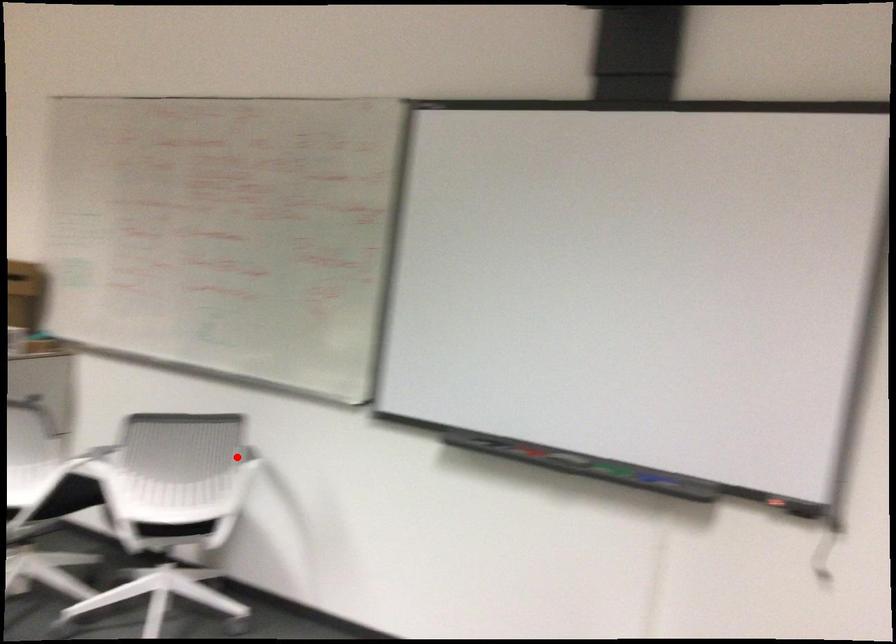
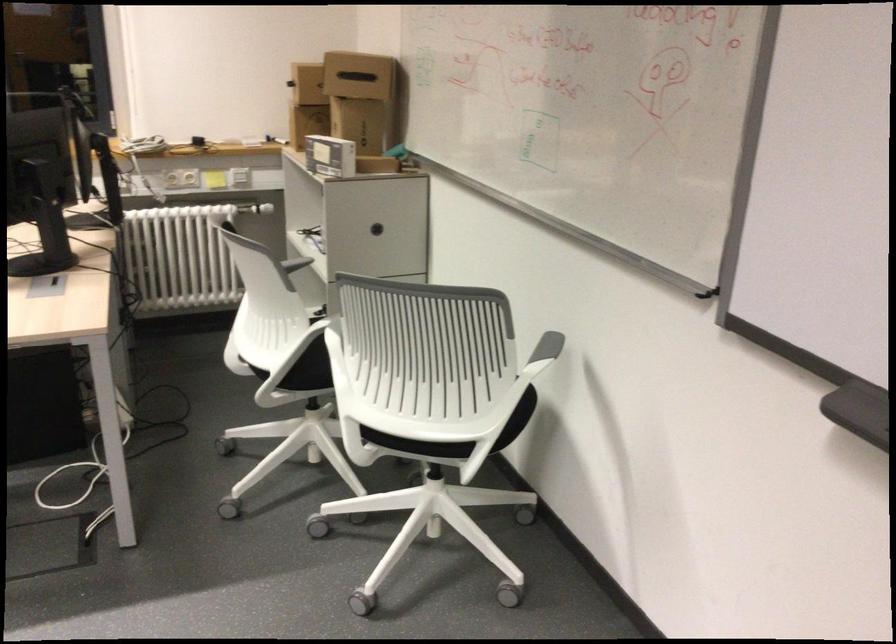
The point at the highlighted location is marked in the first image. Where is the corresponding point in the second image?

(547, 346)